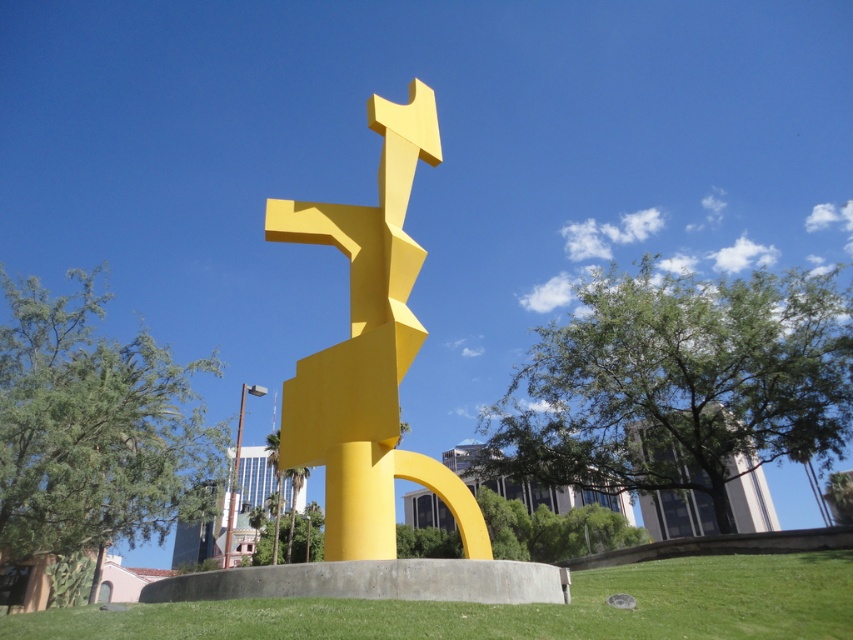
Question: Is matte yellow sculpture at center further to camera compared to green grass at center?

Choices:
 (A) no
 (B) yes

Answer: (B)

Question: Which point is closer to the camera?

Choices:
 (A) green grass at center
 (B) matte yellow sculpture at center

Answer: (A)

Question: Which point is closer to the camera taking this photo?

Choices:
 (A) (398, 138)
 (B) (236, 616)

Answer: (B)

Question: Which point is farther to the camera?

Choices:
 (A) matte yellow sculpture at center
 (B) green grass at center

Answer: (A)

Question: Does matte yellow sculpture at center appear on the left side of green grass at center?

Choices:
 (A) no
 (B) yes

Answer: (B)

Question: Is matte yellow sculpture at center thinner than green grass at center?

Choices:
 (A) yes
 (B) no

Answer: (A)